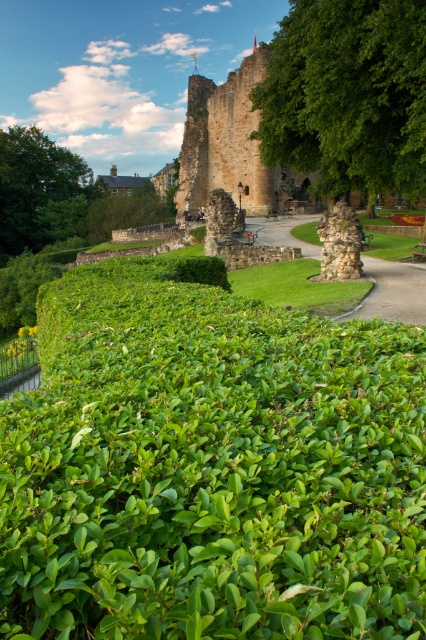
Question: Which point is closer to the camera?

Choices:
 (A) (405, 44)
 (B) (11, 216)

Answer: (A)

Question: Can you confirm if green leafy tree at center is positioned to the left of green leafy tree at upper left?

Choices:
 (A) no
 (B) yes

Answer: (A)

Question: Among these points, which one is nearest to the camera?

Choices:
 (A) (32, 182)
 (B) (313, 102)

Answer: (B)

Question: Is green leafy tree at center thinner than green leafy tree at upper left?

Choices:
 (A) no
 (B) yes

Answer: (B)

Question: Which of the following is the farthest from the observer?

Choices:
 (A) (400, 49)
 (B) (13, 205)

Answer: (B)

Question: Is green leafy tree at center closer to the viewer compared to green leafy tree at upper left?

Choices:
 (A) yes
 (B) no

Answer: (A)